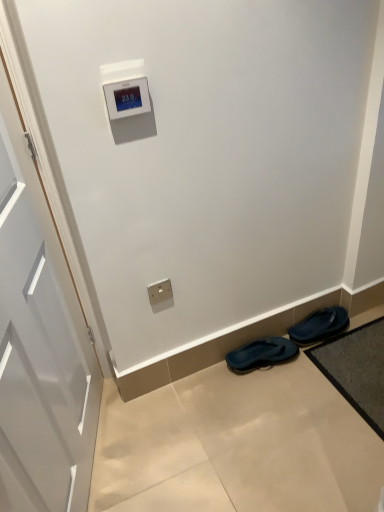
What are the coordinates of `vacant space in front of dark blue rubber flip-flops at lower right, the second footwear from the right` in the screenshot? It's located at (270, 400).